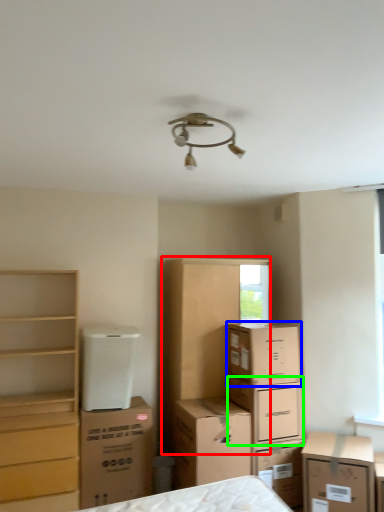
Question: Considering the real-world distances, which object is closest to dresser (highlighted by a red box)? cardboard box (highlighted by a blue box) or cardboard box (highlighted by a green box).

Choices:
 (A) cardboard box
 (B) cardboard box

Answer: (A)